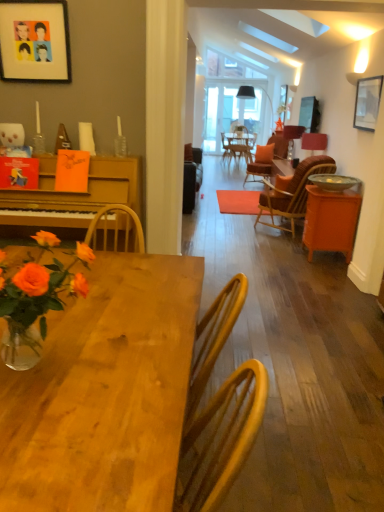
Question: Can you confirm if metallic silver bowl at right is wider than translucent glass vase at lower left?

Choices:
 (A) no
 (B) yes

Answer: (B)

Question: From a real-world perspective, is metallic silver bowl at right below translucent glass vase at lower left?

Choices:
 (A) yes
 (B) no

Answer: (A)

Question: Considering the relative sizes of metallic silver bowl at right and translucent glass vase at lower left in the image provided, is metallic silver bowl at right thinner than translucent glass vase at lower left?

Choices:
 (A) no
 (B) yes

Answer: (A)

Question: Is metallic silver bowl at right outside translucent glass vase at lower left?

Choices:
 (A) yes
 (B) no

Answer: (A)

Question: Is the surface of metallic silver bowl at right in direct contact with translucent glass vase at lower left?

Choices:
 (A) no
 (B) yes

Answer: (A)

Question: From the image's perspective, relative to orange matte cabinet at right, is wooden table at center above or below?

Choices:
 (A) above
 (B) below

Answer: (B)

Question: Considering the positions of wooden table at center and orange matte cabinet at right in the image, is wooden table at center wider or thinner than orange matte cabinet at right?

Choices:
 (A) thin
 (B) wide

Answer: (B)

Question: Considering the positions of wooden table at center and orange matte cabinet at right in the image, is wooden table at center taller or shorter than orange matte cabinet at right?

Choices:
 (A) short
 (B) tall

Answer: (B)

Question: From a real-world perspective, is wooden table at center positioned above or below orange matte cabinet at right?

Choices:
 (A) below
 (B) above

Answer: (B)

Question: Is matte red lampshade at right, which appears as the 1th lamp when ordered from the bottom, taller or shorter than metallic silver bowl at right?

Choices:
 (A) tall
 (B) short

Answer: (A)

Question: From a real-world perspective, relative to metallic silver bowl at right, is matte red lampshade at right, arranged as the first lamp when viewed from the front, vertically above or below?

Choices:
 (A) below
 (B) above

Answer: (B)

Question: In terms of size, does matte red lampshade at right, which is the 2th lamp from back to front, appear bigger or smaller than metallic silver bowl at right?

Choices:
 (A) big
 (B) small

Answer: (B)

Question: Is matte red lampshade at right, which appears as the 1th lamp when ordered from the bottom, wider or thinner than metallic silver bowl at right?

Choices:
 (A) thin
 (B) wide

Answer: (A)

Question: In terms of size, does matte black lampshade at upper center, arranged as the 1th lamp when viewed from the back, appear bigger or smaller than wooden table at center?

Choices:
 (A) big
 (B) small

Answer: (B)

Question: From a real-world perspective, is matte black lampshade at upper center, the first lamp from the top, positioned above or below wooden table at center?

Choices:
 (A) above
 (B) below

Answer: (A)